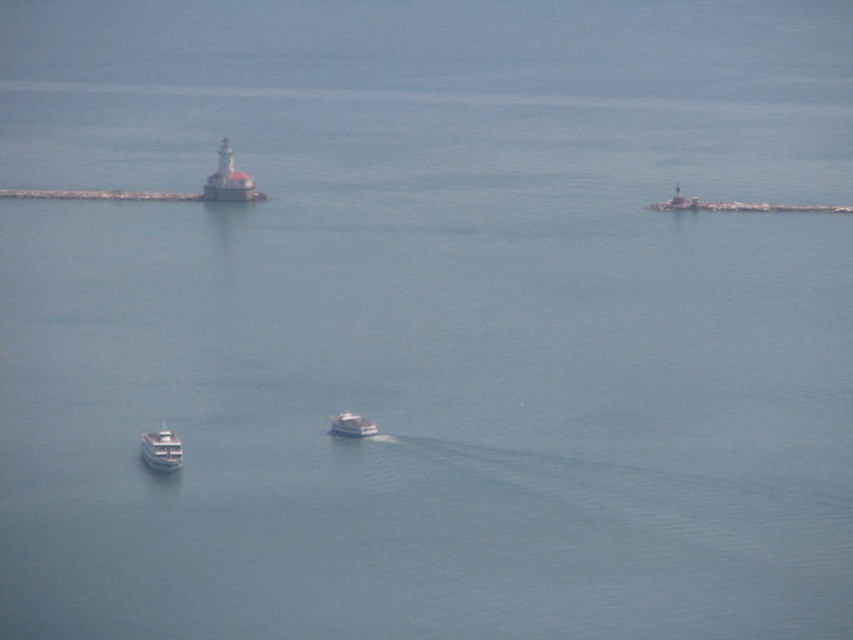
Question: Which point appears closest to the camera in this image?

Choices:
 (A) (146, 445)
 (B) (331, 426)
 (C) (202, 198)

Answer: (B)

Question: Can you confirm if white glossy lighthouse at upper center is positioned to the left of white glossy boat at lower left?

Choices:
 (A) no
 (B) yes

Answer: (A)

Question: Which of the following is the closest to the observer?

Choices:
 (A) (144, 433)
 (B) (241, 195)
 (C) (358, 422)

Answer: (C)

Question: Which point is farther from the camera taking this photo?

Choices:
 (A) (354, 433)
 (B) (161, 461)

Answer: (B)

Question: Can you confirm if white glossy boat at lower left is smaller than white glossy boat at center?

Choices:
 (A) yes
 (B) no

Answer: (B)

Question: Is white glossy lighthouse at upper center to the right of white glossy boat at lower left from the viewer's perspective?

Choices:
 (A) no
 (B) yes

Answer: (B)